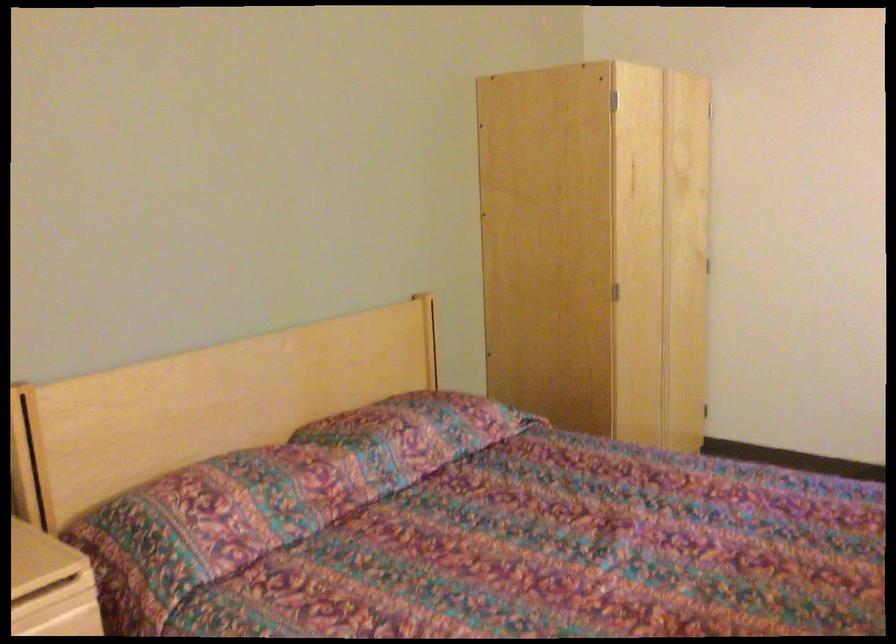
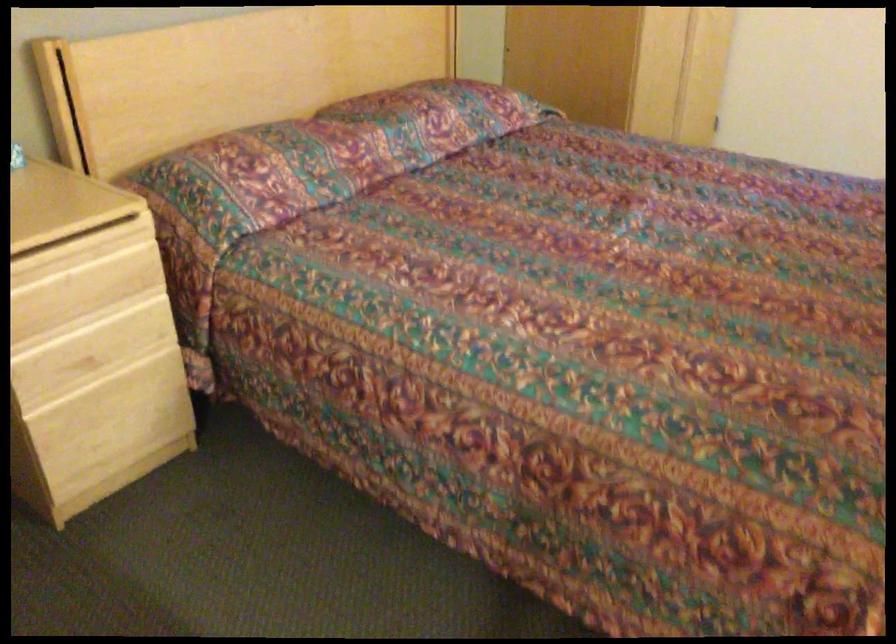
What movement of the cameraman would produce the second image?

The cameraman walked toward left, backward.